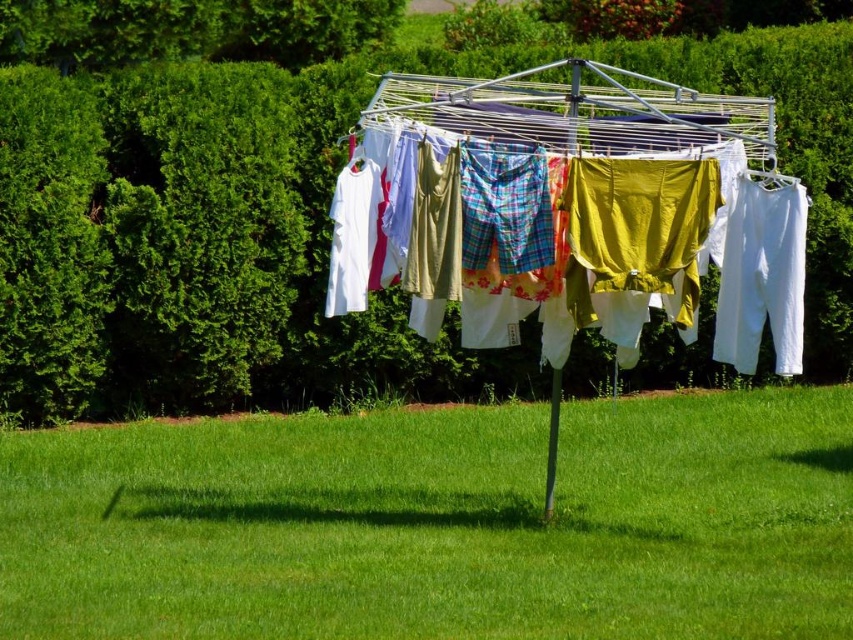
Question: Which object is the closest to the plaid fabric shorts at center?

Choices:
 (A) green grass at center
 (B) matte yellow fabric at center
 (C) green leafy hedge at upper center

Answer: (B)

Question: Which of the following is the farthest from the observer?

Choices:
 (A) (573, 202)
 (B) (572, 288)

Answer: (B)

Question: Can you confirm if green leafy hedge at upper center is positioned above white cotton pants at right?

Choices:
 (A) yes
 (B) no

Answer: (A)

Question: Which object is the closest to the plaid fabric shorts at center?

Choices:
 (A) green grass at center
 (B) white cotton pants at right

Answer: (B)

Question: Does green grass at center appear on the right side of matte yellow fabric at center?

Choices:
 (A) no
 (B) yes

Answer: (A)

Question: Is matte yellow fabric at center in front of white cotton pants at right?

Choices:
 (A) yes
 (B) no

Answer: (B)